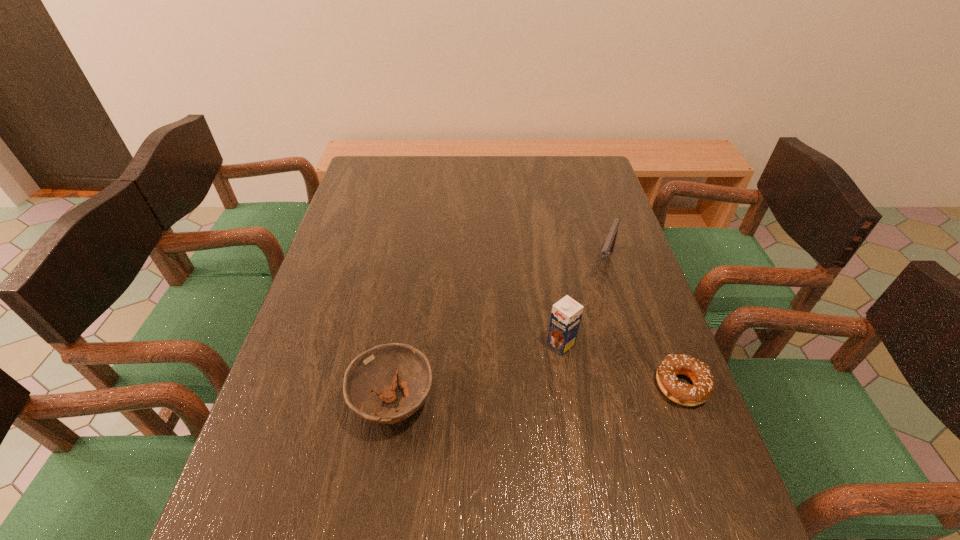
Locate an element on the screen. This screenshot has height=540, width=960. the second shortest object is located at coordinates (372, 377).

Find the location of a particular element. the leftmost object is located at coordinates (372, 377).

Find the location of a particular element. doughnut is located at coordinates (685, 394).

The image size is (960, 540). Identify the location of pistol. (608, 247).

What are the coordinates of `the farthest object` in the screenshot? It's located at (608, 247).

You are a GUI agent. You are given a task and a screenshot of the screen. Output one action in this format:
    pyautogui.click(x=<x>, y=<y>)
    Task: Click on the chocolate milk
    
    Given the screenshot: What is the action you would take?
    pyautogui.click(x=566, y=314)

Identify the location of the third object from right to left. Image resolution: width=960 pixels, height=540 pixels. (566, 314).

This screenshot has width=960, height=540. I want to click on free space located 0.050m on the left of the third tallest object, so click(x=328, y=401).

The image size is (960, 540). Find the location of `vacant region located on the back of the doughnut`. vacant region located on the back of the doughnut is located at coordinates (642, 281).

Where is `free location located at the barrel of the pistol`? free location located at the barrel of the pistol is located at coordinates (559, 400).